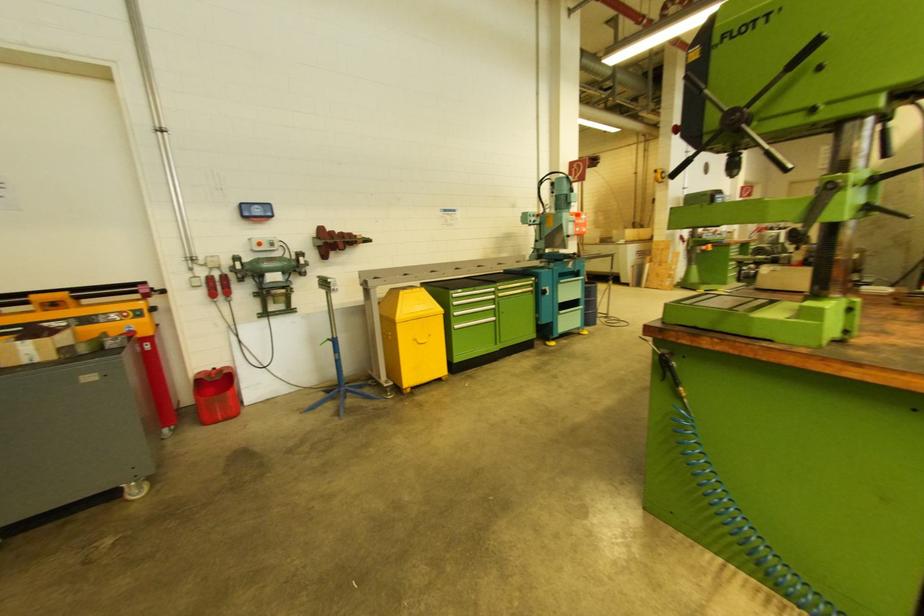
What do you see at coordinates (473, 299) in the screenshot? The height and width of the screenshot is (616, 924). I see `the green drawer handle` at bounding box center [473, 299].